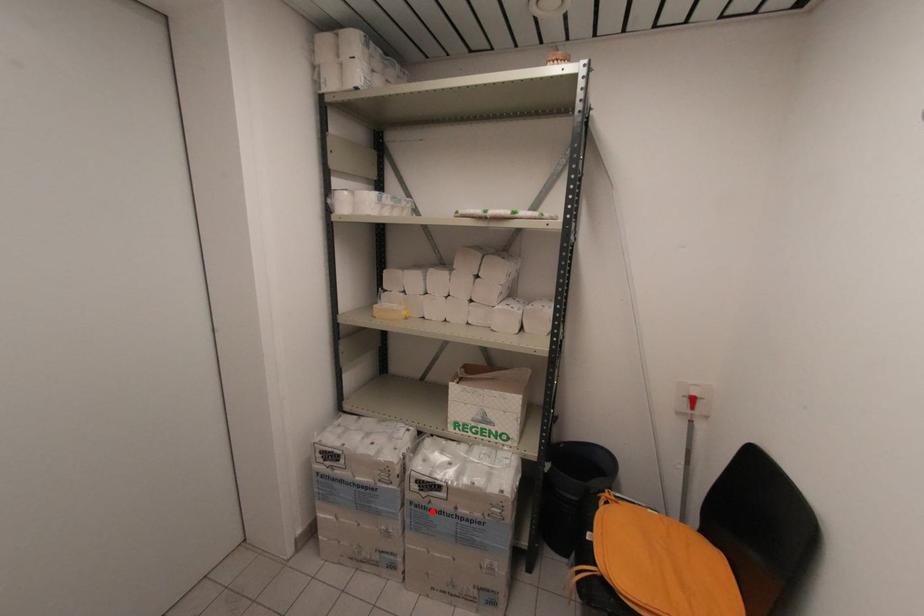
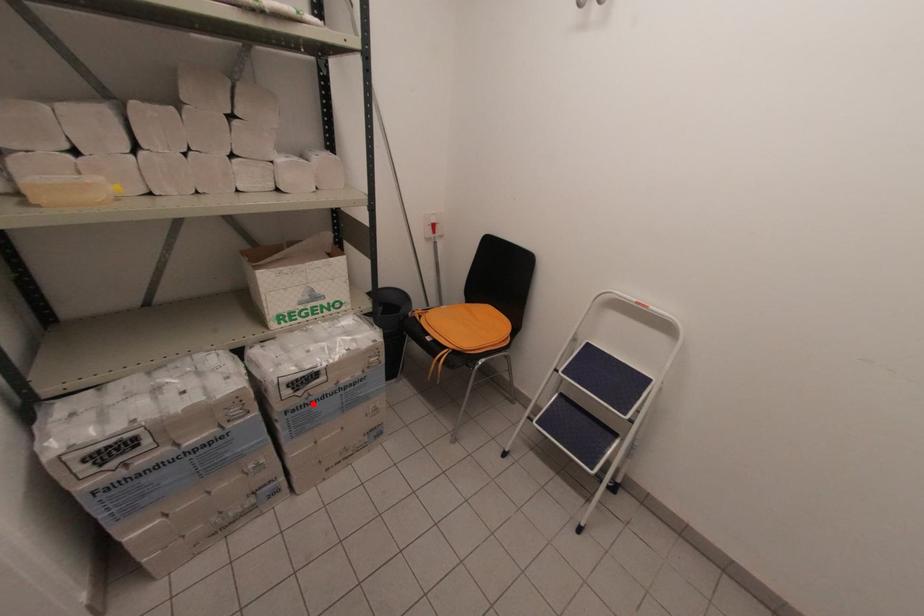
I am providing you with two images of the same scene from different viewpoints. A red point is marked on the first image and another point is marked on the second image. Is the red point in image1 aligned with the point shown in image2?

Yes